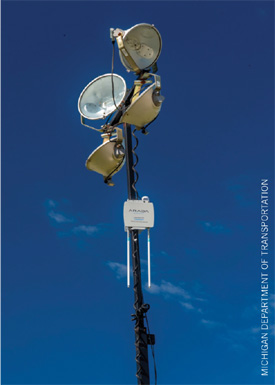
What are the coordinates of `left side of lightingn source` in the screenshot? It's located at (50, 265).